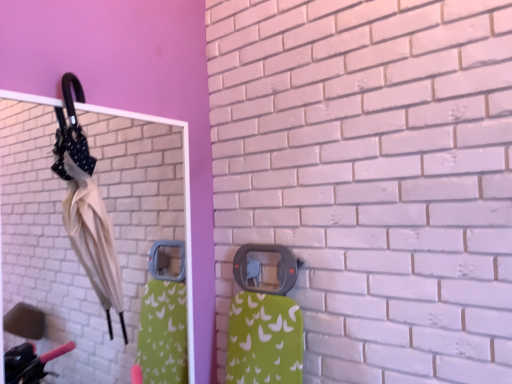
Question: Would you say beige fabric umbrella at left is a long distance from matte plastic door handle at center?

Choices:
 (A) yes
 (B) no

Answer: (B)

Question: Can you confirm if beige fabric umbrella at left is positioned to the right of matte plastic door handle at center?

Choices:
 (A) no
 (B) yes

Answer: (A)

Question: Does beige fabric umbrella at left appear on the left side of matte plastic door handle at center?

Choices:
 (A) no
 (B) yes

Answer: (B)

Question: Would you say matte plastic door handle at center is part of beige fabric umbrella at left's contents?

Choices:
 (A) yes
 (B) no

Answer: (B)

Question: From the image's perspective, is beige fabric umbrella at left located above matte plastic door handle at center?

Choices:
 (A) yes
 (B) no

Answer: (A)

Question: Relative to matte plastic door handle at center, is beige fabric umbrella at left in front or behind?

Choices:
 (A) front
 (B) behind

Answer: (A)

Question: Considering the relative positions of beige fabric umbrella at left and matte plastic door handle at center in the image provided, is beige fabric umbrella at left to the left or to the right of matte plastic door handle at center?

Choices:
 (A) left
 (B) right

Answer: (A)

Question: Which is correct: beige fabric umbrella at left is inside matte plastic door handle at center, or outside of it?

Choices:
 (A) inside
 (B) outside

Answer: (B)

Question: In terms of width, does beige fabric umbrella at left look wider or thinner when compared to matte plastic door handle at center?

Choices:
 (A) wide
 (B) thin

Answer: (A)

Question: Is point [271, 249] positioned closer to the camera than point [87, 142]?

Choices:
 (A) farther
 (B) closer

Answer: (A)

Question: Would you say matte plastic door handle at center is inside or outside beige fabric umbrella at left?

Choices:
 (A) outside
 (B) inside

Answer: (A)

Question: From the image's perspective, relative to beige fabric umbrella at left, is matte plastic door handle at center above or below?

Choices:
 (A) above
 (B) below

Answer: (B)

Question: Considering the positions of matte plastic door handle at center and beige fabric umbrella at left in the image, is matte plastic door handle at center wider or thinner than beige fabric umbrella at left?

Choices:
 (A) wide
 (B) thin

Answer: (B)

Question: Is point (78, 213) positioned closer to the camera than point (40, 192)?

Choices:
 (A) farther
 (B) closer

Answer: (B)

Question: Considering their positions, is beige fabric umbrella at left located in front of or behind white glossy mirror at upper left?

Choices:
 (A) front
 (B) behind

Answer: (B)